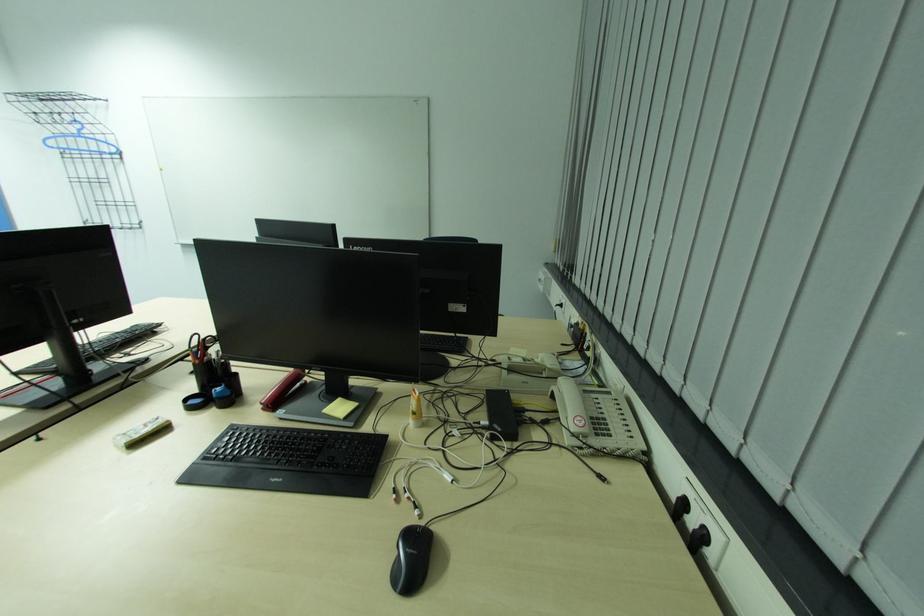
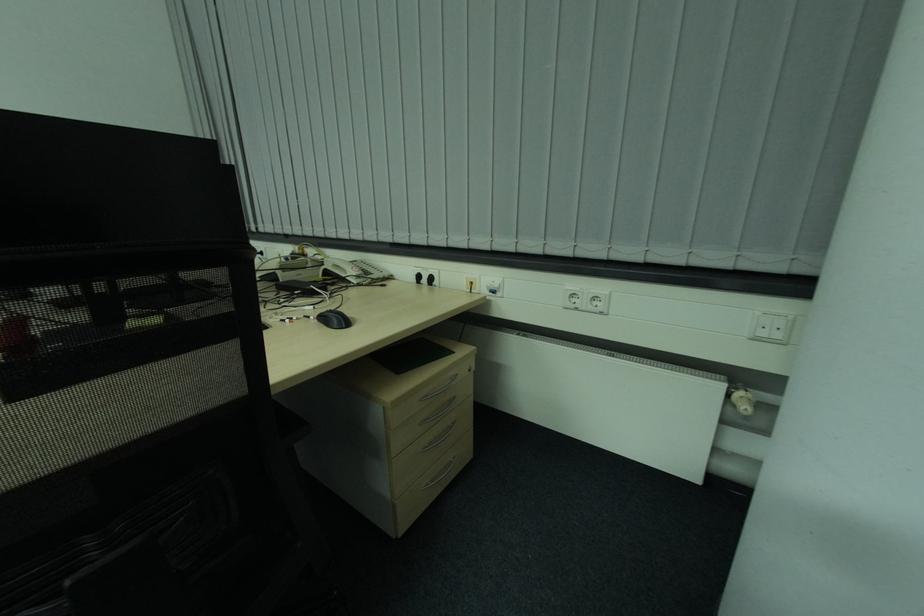
Question: How did the camera likely rotate?

Choices:
 (A) Left
 (B) Right
 (C) Up
 (D) Down

Answer: (B)